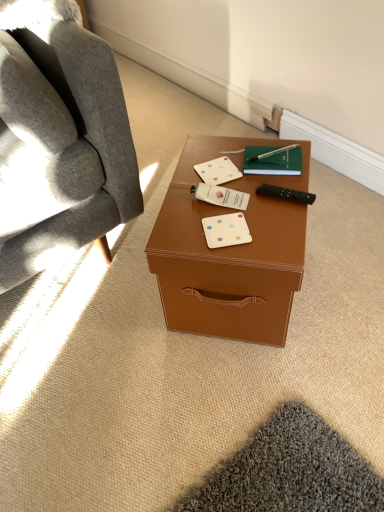
This screenshot has height=512, width=384. I want to click on unoccupied region to the right of white matte business card at center, which ranks as the first business card in back-to-front order, so click(x=263, y=175).